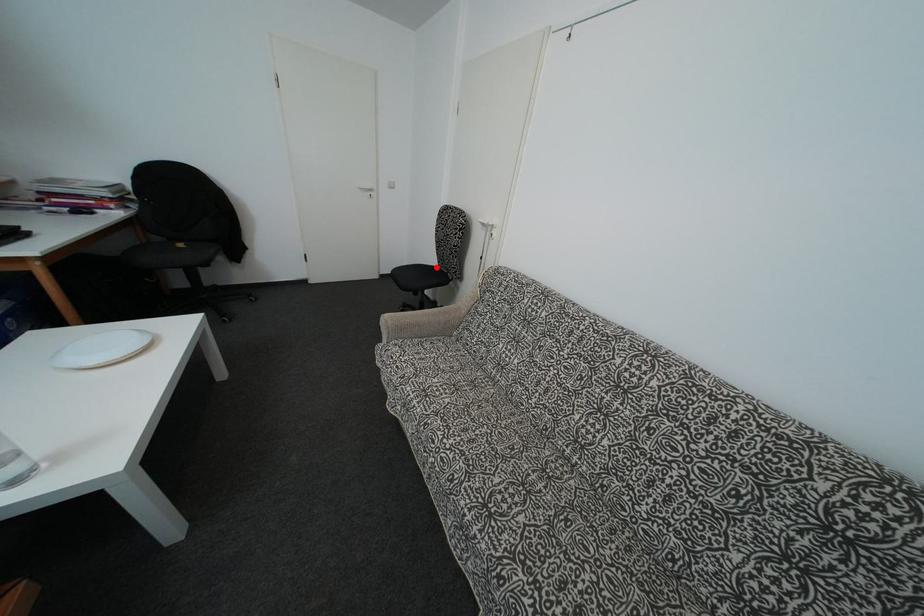
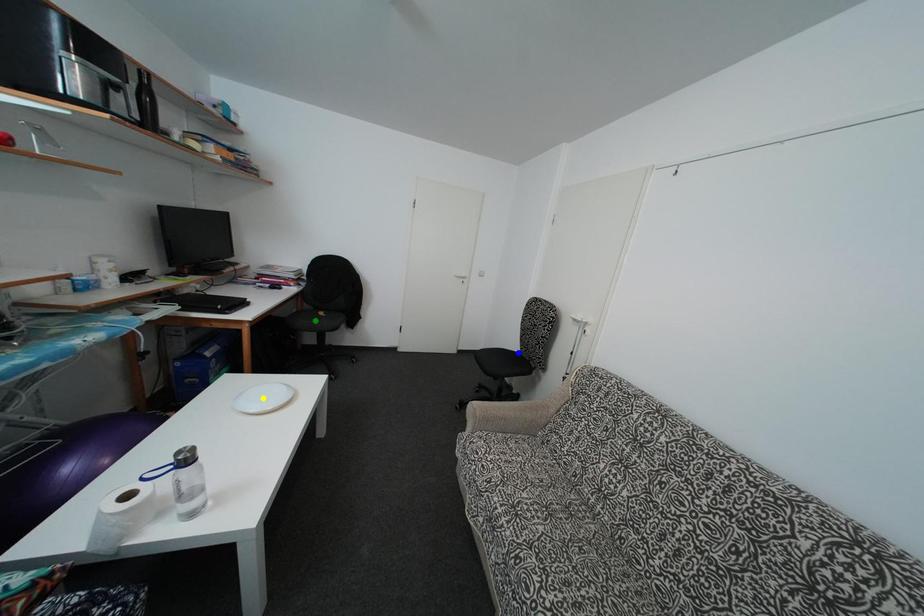
Question: I am providing you with two images of the same scene from different viewpoints. A red point is marked on the first image. You are given multiple points on the second image. Which point in image 2 is actually the same real-world point as the red point in image 1?

Choices:
 (A) blue point
 (B) yellow point
 (C) green point

Answer: (A)